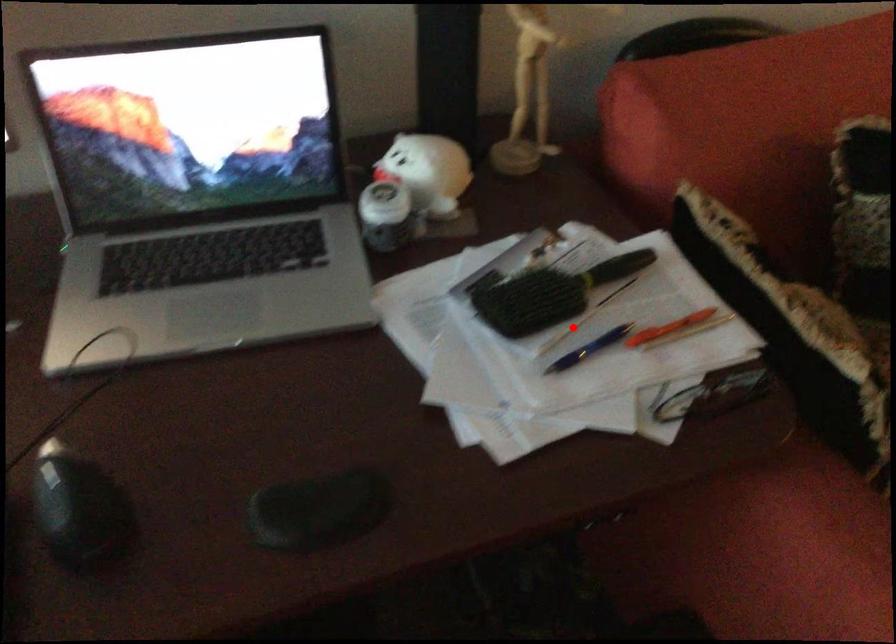
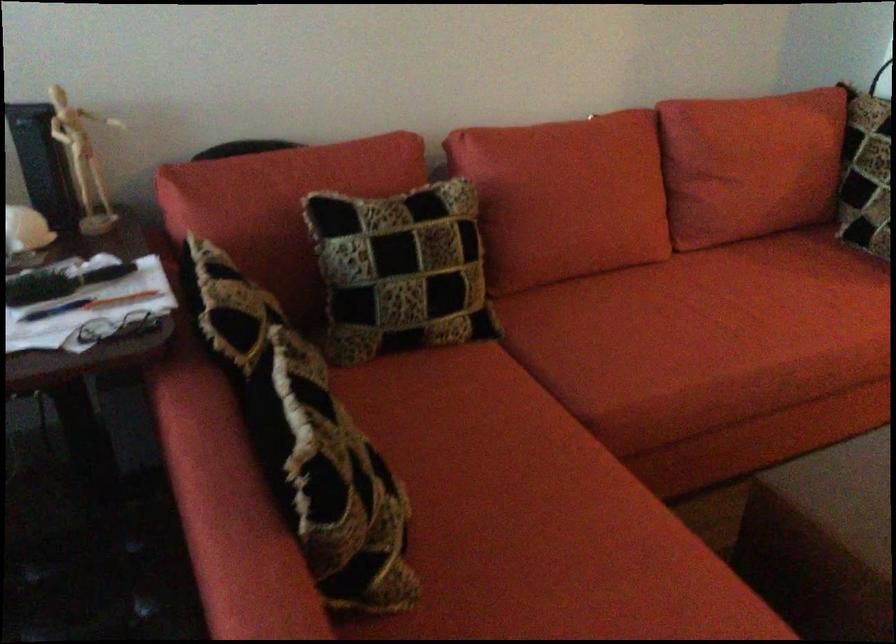
Question: I am providing you with two images of the same scene from different viewpoints. Given a red point in image1, look at the same physical point in image2. Is it:

Choices:
 (A) Closer to the viewpoint
 (B) Farther from the viewpoint

Answer: (B)